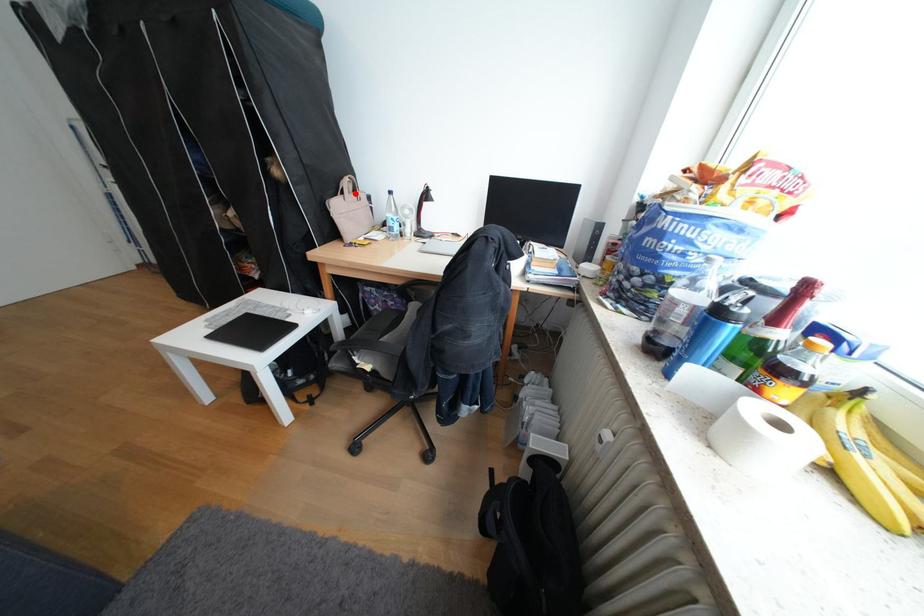
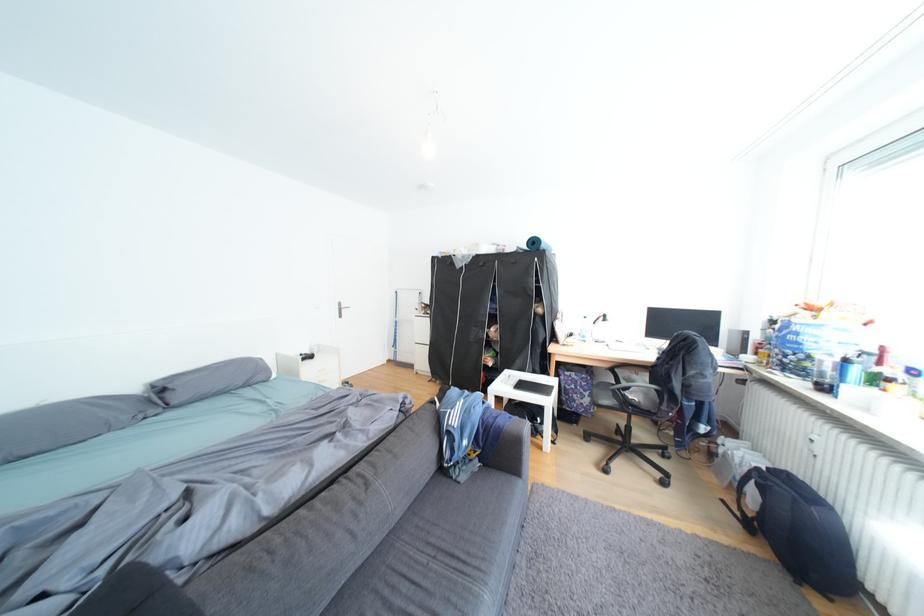
The point at the highlighted location is marked in the first image. Where is the corresponding point in the second image?

(570, 318)